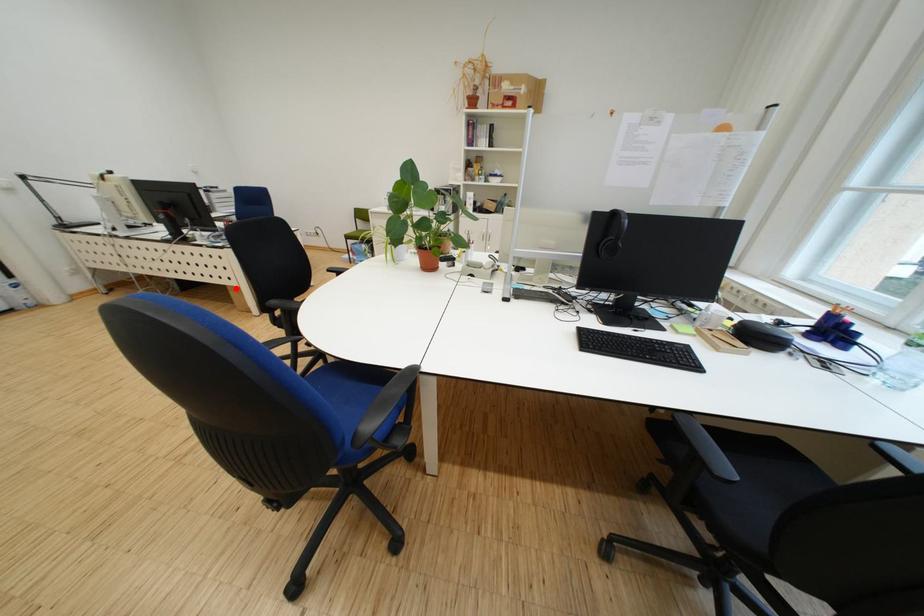
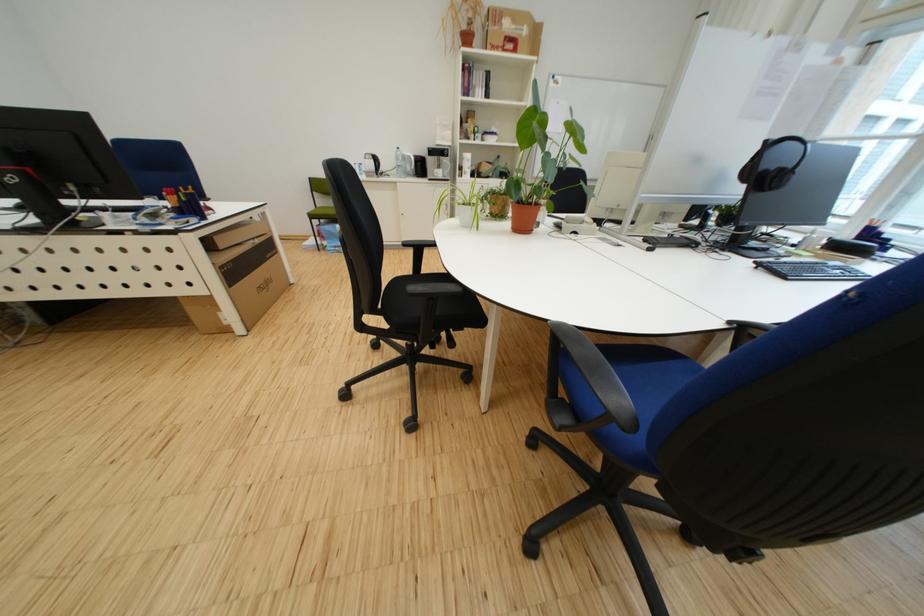
Locate, in the second image, the point that corresponds to the highlighted location in the first image.

(186, 301)